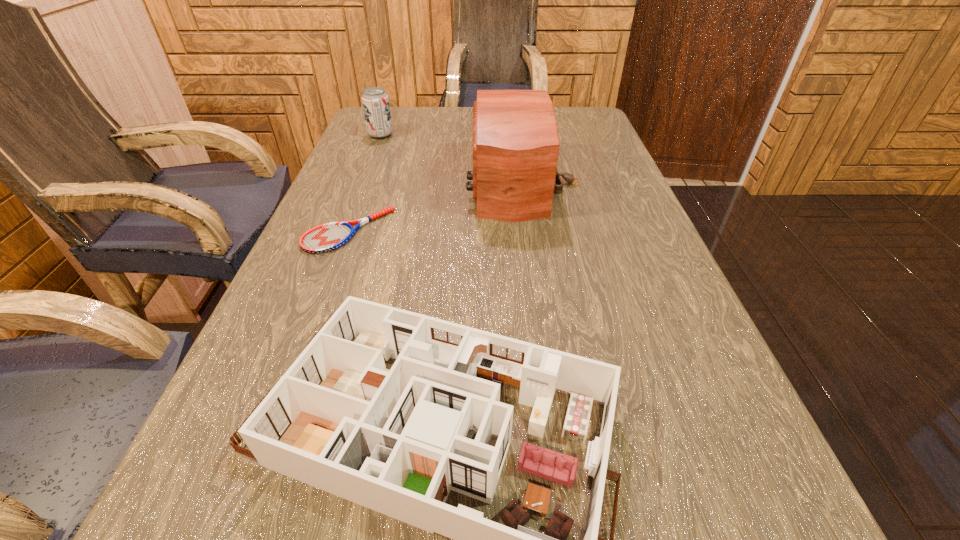
Where is `radio receiver`? radio receiver is located at coordinates (515, 148).

Identify the location of beer can. Image resolution: width=960 pixels, height=540 pixels. (375, 101).

Find the location of a particular element. This screenshot has height=540, width=960. the second tallest object is located at coordinates (375, 101).

You are a GUI agent. You are given a task and a screenshot of the screen. Output one action in this format:
    pyautogui.click(x=<x>, y=<y>)
    Task: Click on the tennis racket
    This screenshot has width=960, height=540.
    Given the screenshot: What is the action you would take?
    coord(327,237)

The image size is (960, 540). What are the coordinates of `vacant area situated 0.220m on the front-facing side of the radio receiver` in the screenshot? It's located at (380, 184).

This screenshot has width=960, height=540. Find the location of `vacant area located on the front-facing side of the radio receiver`. vacant area located on the front-facing side of the radio receiver is located at coordinates (348, 184).

The image size is (960, 540). I want to click on free space located 0.280m on the front-facing side of the radio receiver, so click(x=356, y=184).

Locate an element on the screen. The height and width of the screenshot is (540, 960). free region located 0.050m on the back of the farthest object is located at coordinates (385, 123).

The image size is (960, 540). I want to click on vacant region located 0.160m on the right of the shortest object, so click(x=464, y=231).

Locate an element on the screen. This screenshot has width=960, height=540. object located in the far edge section of the desktop is located at coordinates (375, 101).